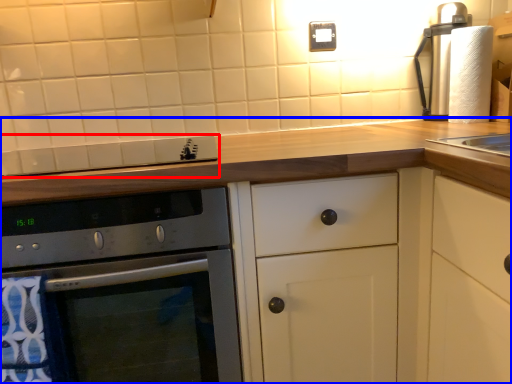
Question: Which of the following is the closest to the observer, gas stove (highlighted by a red box) or cabinetry (highlighted by a blue box)?

Choices:
 (A) gas stove
 (B) cabinetry

Answer: (B)